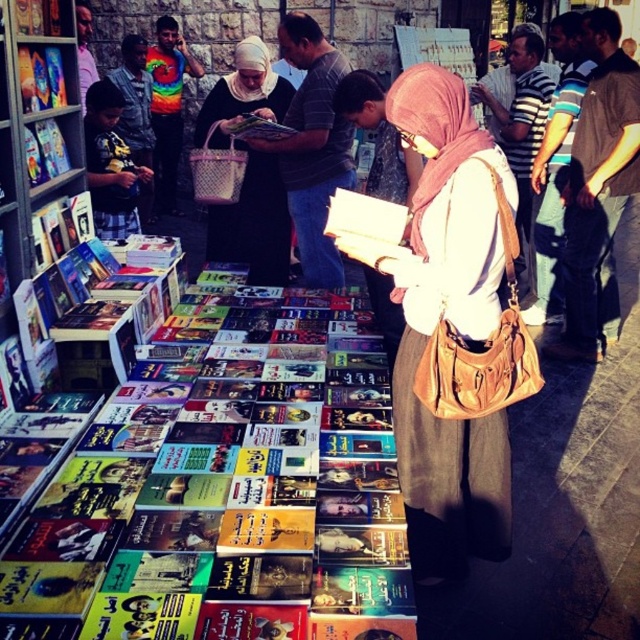
Question: Can you confirm if matte beige scarf at center is thinner than matte black book at center?

Choices:
 (A) yes
 (B) no

Answer: (B)

Question: Can you confirm if matte beige scarf at center is positioned to the right of matte black shirt at center?

Choices:
 (A) yes
 (B) no

Answer: (A)

Question: Which point is farther to the camera?

Choices:
 (A) hardcover book at center
 (B) matte beige scarf at center
 (C) matte black shirt at center

Answer: (C)

Question: Which point is farther from the camera taking this photo?

Choices:
 (A) (445, 77)
 (B) (257, 122)
 (C) (317, 112)

Answer: (B)

Question: Is hardcover book at center positioned before matte black shirt at center?

Choices:
 (A) yes
 (B) no

Answer: (A)

Question: Which point is closer to the camera?

Choices:
 (A) (252, 440)
 (B) (452, 106)

Answer: (B)